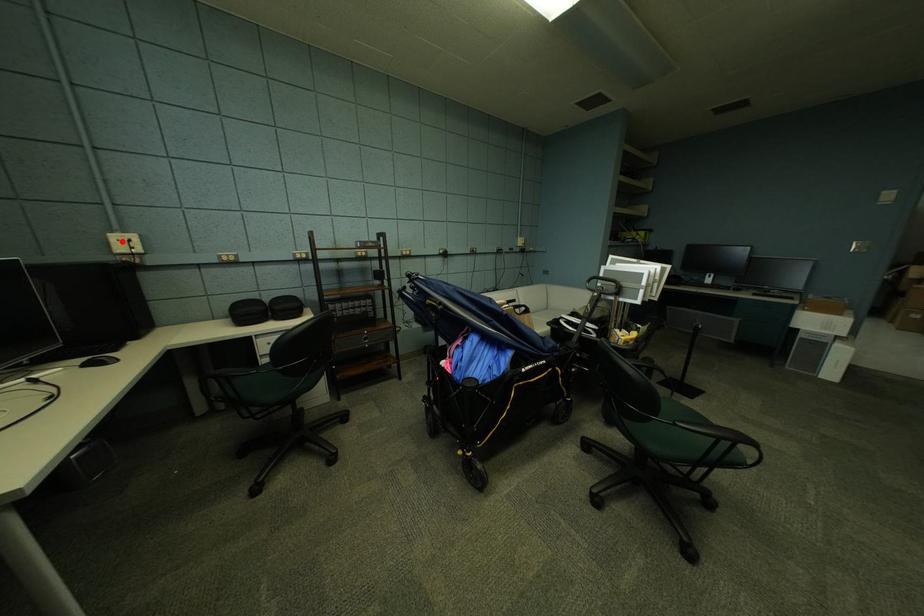
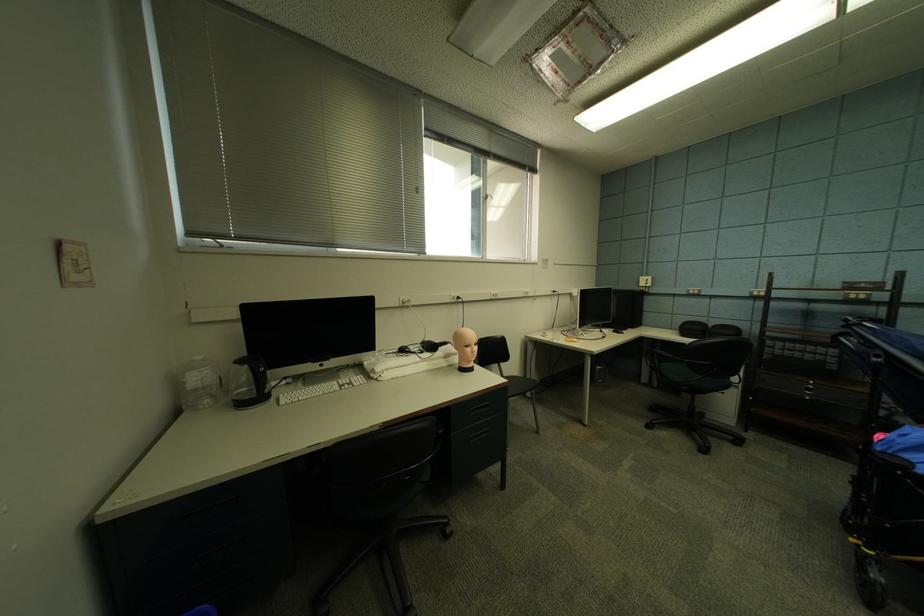
Find the pixel in the second image that matches the highlighted location in the first image.

(650, 282)